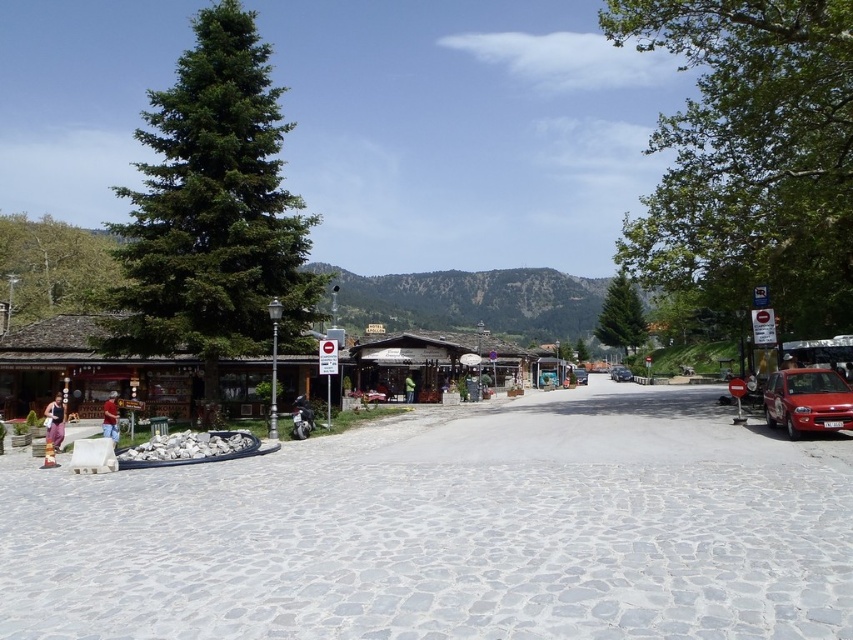
Question: Which point is closer to the camera?

Choices:
 (A) (613, 376)
 (B) (577, 374)
 (C) (840, 417)
 (D) (107, 412)

Answer: (C)

Question: Is green glossy pine at left wider than green textured pine at center?

Choices:
 (A) yes
 (B) no

Answer: (A)

Question: Is shiny red car at right wider than red matte car at center?

Choices:
 (A) no
 (B) yes

Answer: (A)

Question: Where is green glossy pine at left located in relation to green textured pine at center in the image?

Choices:
 (A) below
 (B) above

Answer: (B)

Question: Among these objects, which one is farthest from the camera?

Choices:
 (A) shiny red car at center
 (B) wooden shop at left
 (C) green fabric jacket at center

Answer: (A)

Question: Among these points, which one is farthest from the camera?

Choices:
 (A) (405, 380)
 (B) (576, 381)
 (C) (614, 378)

Answer: (C)